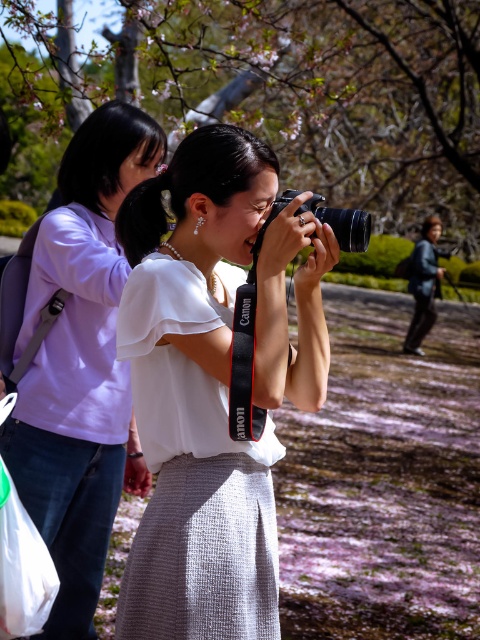
Is point (19, 385) less distant than point (164, 346)?

No, (19, 385) is further to viewer.

I want to click on matte white shirt at upper left, so click(81, 365).

The width and height of the screenshot is (480, 640). I want to click on matte white shirt at upper left, so click(x=81, y=365).

Based on the photo, between matte white shirt at upper left and dark gray fabric jacket at right, which one appears on the left side from the viewer's perspective?

matte white shirt at upper left is more to the left.

Is matte white shirt at upper left shorter than dark gray fabric jacket at right?

Correct, matte white shirt at upper left is not as tall as dark gray fabric jacket at right.

Find the location of a particular element. matte white shirt at upper left is located at coordinates (x=81, y=365).

Does slightly glossy brown tree at upper center appear under white textured dress at center?

No.

Is point (230, 58) farther from camera compared to point (232, 540)?

Yes, it is.

Between point (334, 92) and point (226, 397), which one is positioned behind?

Positioned behind is point (334, 92).

At what (x,y) coordinates should I click in order to perform the action: click on slightly glossy brown tree at upper center. Please return your answer as a coordinate pair (x, y). The height and width of the screenshot is (640, 480). Looking at the image, I should click on pos(275,93).